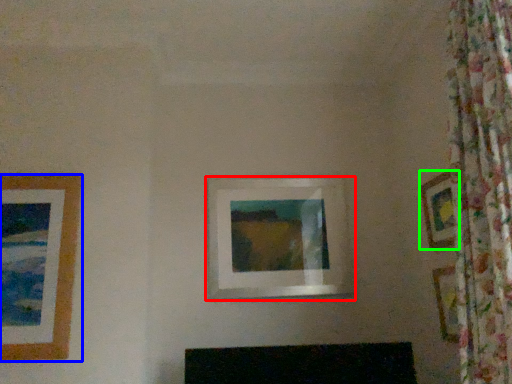
Question: Based on their relative distances, which object is farther from picture frame (highlighted by a red box)? Choose from picture frame (highlighted by a blue box) and picture frame (highlighted by a green box).

Choices:
 (A) picture frame
 (B) picture frame

Answer: (A)